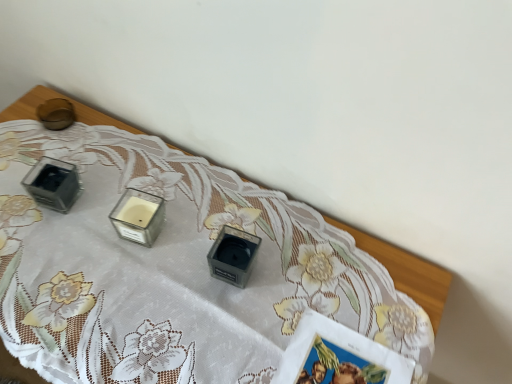
Question: Is matte glass candle at upper left at the back of clear glass candle at center?

Choices:
 (A) yes
 (B) no

Answer: (B)

Question: Considering the relative sizes of clear glass candle at center and matte glass candle at upper left in the image provided, is clear glass candle at center smaller than matte glass candle at upper left?

Choices:
 (A) yes
 (B) no

Answer: (A)

Question: Is clear glass candle at center with matte glass candle at upper left?

Choices:
 (A) yes
 (B) no

Answer: (B)

Question: Does clear glass candle at center have a larger size compared to matte glass candle at upper left?

Choices:
 (A) yes
 (B) no

Answer: (B)

Question: Is clear glass candle at center positioned before matte glass candle at upper left?

Choices:
 (A) yes
 (B) no

Answer: (B)

Question: Is the depth of clear glass candle at center greater than that of matte glass candle at upper left?

Choices:
 (A) no
 (B) yes

Answer: (B)

Question: From the image's perspective, is matte glass candle at upper left beneath clear glass candle at center?

Choices:
 (A) no
 (B) yes

Answer: (B)

Question: Is matte glass candle at upper left positioned far away from clear glass candle at center?

Choices:
 (A) no
 (B) yes

Answer: (A)

Question: Can you confirm if matte glass candle at upper left is bigger than clear glass candle at center?

Choices:
 (A) yes
 (B) no

Answer: (A)

Question: From the image's perspective, is matte glass candle at upper left located above clear glass candle at center?

Choices:
 (A) no
 (B) yes

Answer: (A)

Question: Is matte glass candle at upper left facing away from clear glass candle at center?

Choices:
 (A) no
 (B) yes

Answer: (A)

Question: From a real-world perspective, does matte glass candle at upper left sit lower than clear glass candle at center?

Choices:
 (A) no
 (B) yes

Answer: (B)

Question: Is matte glass candle at upper left situated inside clear glass candle at center or outside?

Choices:
 (A) outside
 (B) inside

Answer: (A)